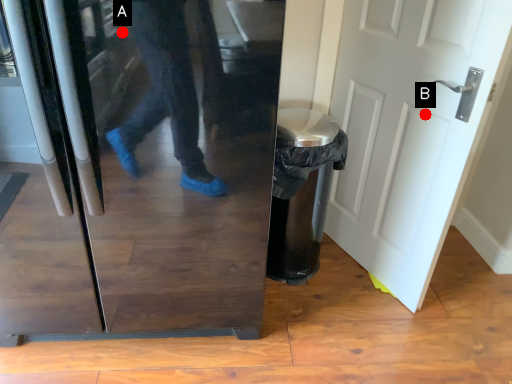
Question: Two points are circled on the image, labeled by A and B beside each circle. Which point appears closest to the camera in this image?

Choices:
 (A) A is closer
 (B) B is closer

Answer: (A)